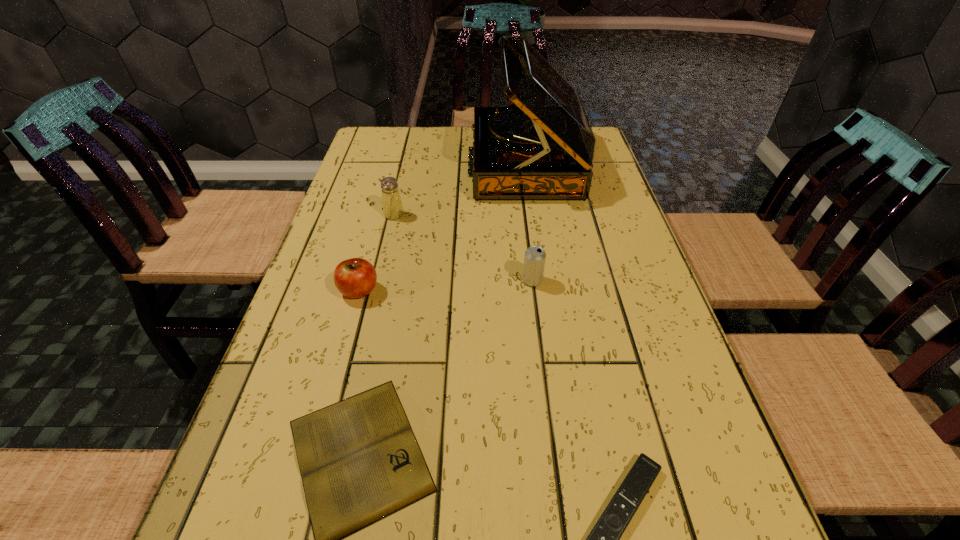
Locate an element on the screen. free space located 0.260m on the back of the beer can is located at coordinates (523, 208).

You are a GUI agent. You are given a task and a screenshot of the screen. Output one action in this format:
    pyautogui.click(x=<x>, y=<y>)
    Task: Click on the vacant area situated on the right of the apple
    This screenshot has height=540, width=960.
    Given the screenshot: What is the action you would take?
    pyautogui.click(x=533, y=291)

You are a GUI agent. You are given a task and a screenshot of the screen. Output one action in this format:
    pyautogui.click(x=<x>, y=<y>)
    Task: Click on the object that is at the far edge
    The width and height of the screenshot is (960, 540).
    Given the screenshot: What is the action you would take?
    pyautogui.click(x=543, y=149)

Locate an element on the screen. saltshaker that is at the left edge is located at coordinates (392, 205).

Where is `apple at the left edge`? apple at the left edge is located at coordinates (356, 277).

Locate an element on the screen. object that is positioned at the right edge is located at coordinates 543,149.

Find the location of `object that is at the far right corner`. object that is at the far right corner is located at coordinates coord(543,149).

Identify the location of free space at the far edge of the desktop. The width and height of the screenshot is (960, 540). (444, 153).

This screenshot has width=960, height=540. I want to click on vacant space at the left edge, so click(x=276, y=480).

In the image, there is a desktop. Where is `vacant area at the right edge`? This screenshot has width=960, height=540. vacant area at the right edge is located at coordinates click(687, 409).